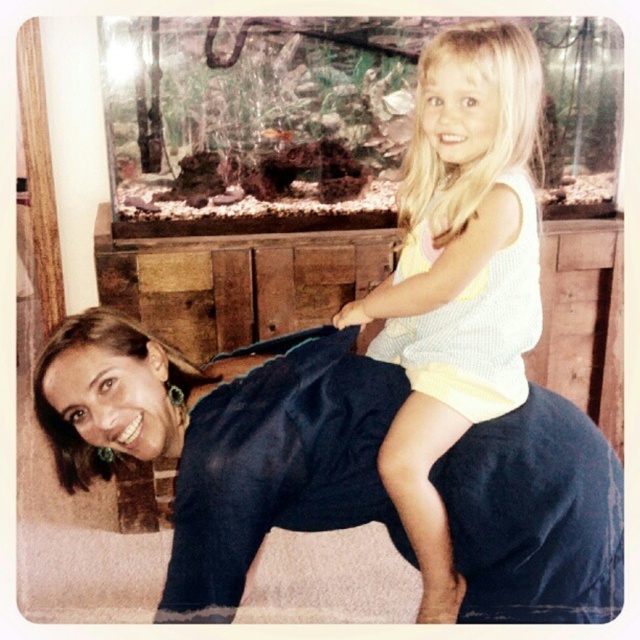
Question: Which point is closer to the camera taking this photo?

Choices:
 (A) (381, 332)
 (B) (369, 476)

Answer: (B)

Question: Which object appears farthest from the camera in this image?

Choices:
 (A) light yellow knit tank top at upper right
 (B) dark blue fabric at center

Answer: (A)

Question: Which point is farther to the camera?

Choices:
 (A) light yellow knit tank top at upper right
 (B) dark blue fabric at center

Answer: (A)

Question: Does dark blue fabric at center appear over light yellow knit tank top at upper right?

Choices:
 (A) yes
 (B) no

Answer: (B)

Question: Where is dark blue fabric at center located in relation to light yellow knit tank top at upper right in the image?

Choices:
 (A) below
 (B) above

Answer: (A)

Question: Does dark blue fabric at center have a lesser width compared to light yellow knit tank top at upper right?

Choices:
 (A) yes
 (B) no

Answer: (B)